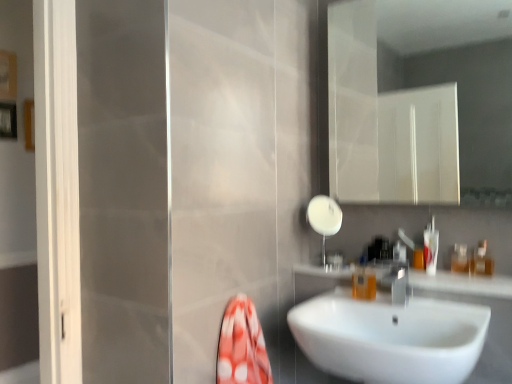
Identify the location of free space to the left of translucent plastic container at right, marked as the second toiletry in a right-to-left arrangement. (435, 275).